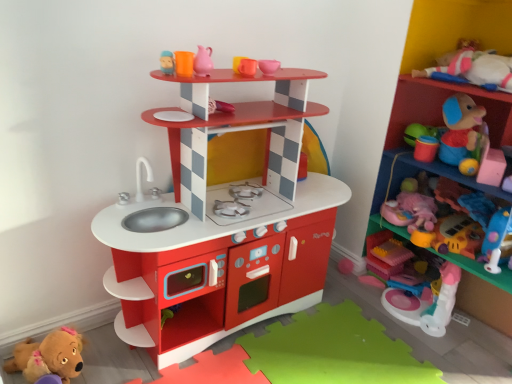
Where is `vacant area that is in front of pink plastic toy at right, the 3th toy in the right-to-left sequence`? The height and width of the screenshot is (384, 512). vacant area that is in front of pink plastic toy at right, the 3th toy in the right-to-left sequence is located at coordinates (419, 349).